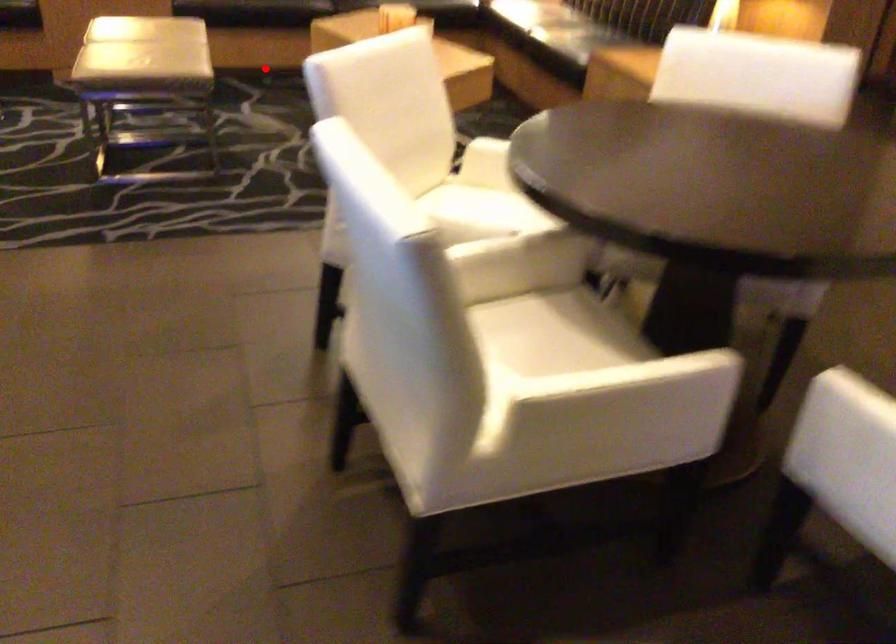
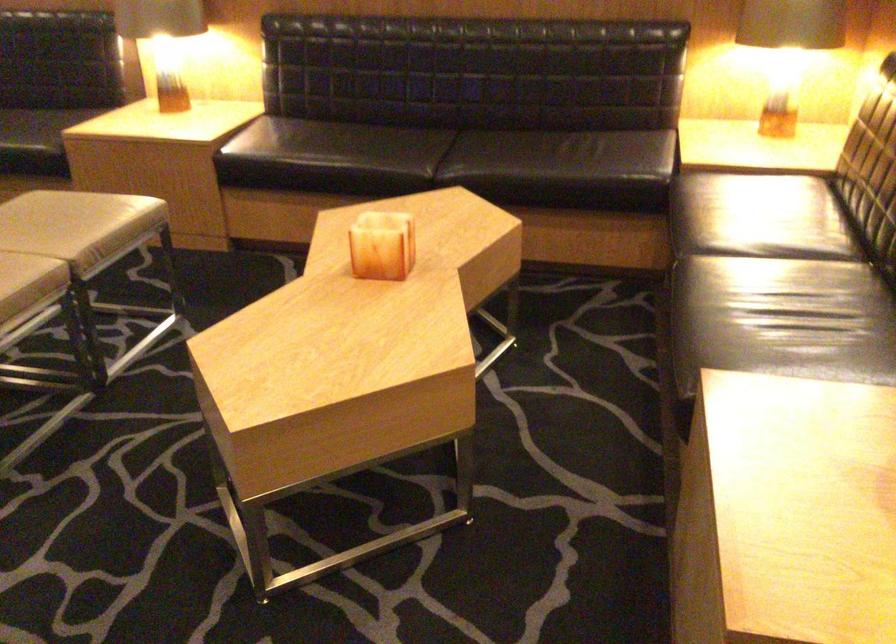
In the second image, find the point that corresponds to the highlighted location in the first image.

(283, 263)